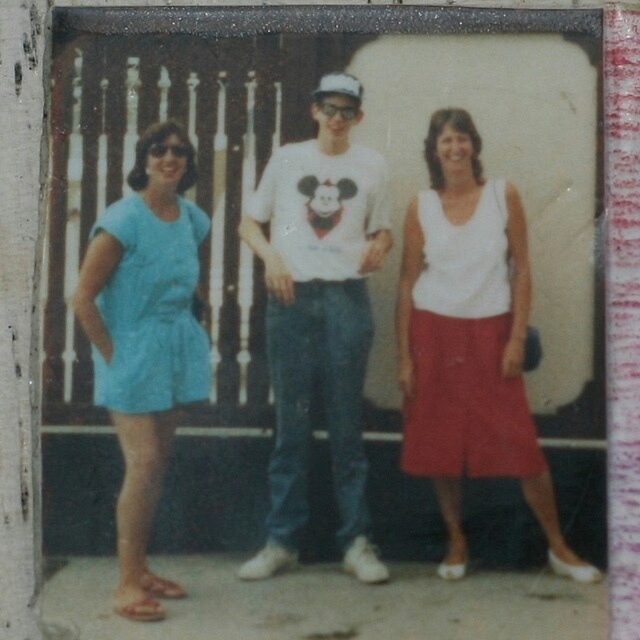
Based on the scene described, can you determine which clothing item is positioned higher between the white matte tank top at center and the light blue fabric dress at left?

The white matte tank top at center is positioned higher than the light blue fabric dress at left according to the description.